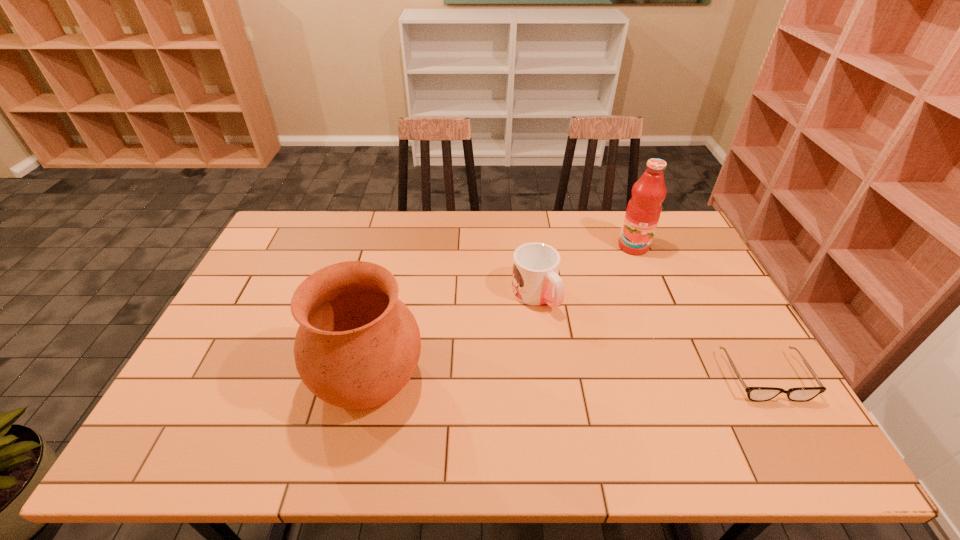
At what (x,y) coordinates should I click in order to perform the action: click on free spot between the fruit juice and the rightmost object. Please return your answer as a coordinate pair (x, y). Looking at the image, I should click on (699, 312).

Where is `vacant area between the third object from right to left and the third object from left to right`? vacant area between the third object from right to left and the third object from left to right is located at coordinates (584, 271).

Identify the location of empty space that is in between the spectacles and the third object from left to right. (699, 312).

At what (x,y) coordinates should I click in order to perform the action: click on free space between the third object from left to right and the pottery. Please return your answer as a coordinate pair (x, y). Image resolution: width=960 pixels, height=540 pixels. Looking at the image, I should click on (501, 312).

This screenshot has width=960, height=540. I want to click on unoccupied area between the second shortest object and the rightmost object, so click(650, 336).

Find the location of a particular element. vacant region between the shortest object and the second object from right to left is located at coordinates (699, 312).

Locate an element on the screen. This screenshot has width=960, height=540. object that is the third closest one to the shortest object is located at coordinates (357, 346).

Identify the location of object identified as the closest to the third object from left to right. (535, 281).

Find the location of a particular element. Image resolution: width=960 pixels, height=540 pixels. free region that satisfies the following two spatial constraints: 1. on the back side of the second farthest object; 2. on the left side of the fruit juice is located at coordinates (528, 246).